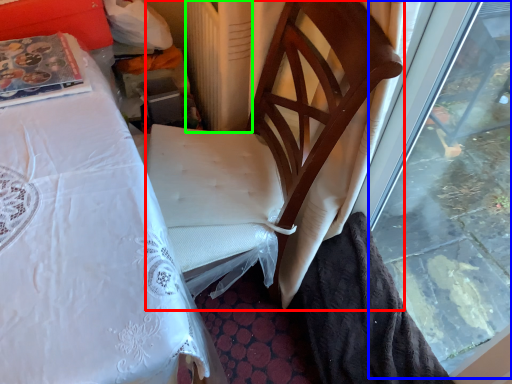
Question: Estimate the real-world distances between objects in this image. Which object is farther from chair (highlighted by a red box), window (highlighted by a blue box) or radiator (highlighted by a green box)?

Choices:
 (A) window
 (B) radiator

Answer: (A)